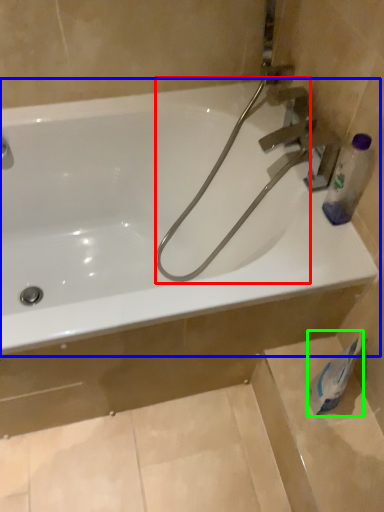
Question: Estimate the real-world distances between objects in this image. Which object is closer to garden hose (highlighted by a red box), bathtub (highlighted by a blue box) or toilet paper (highlighted by a green box)?

Choices:
 (A) bathtub
 (B) toilet paper

Answer: (A)